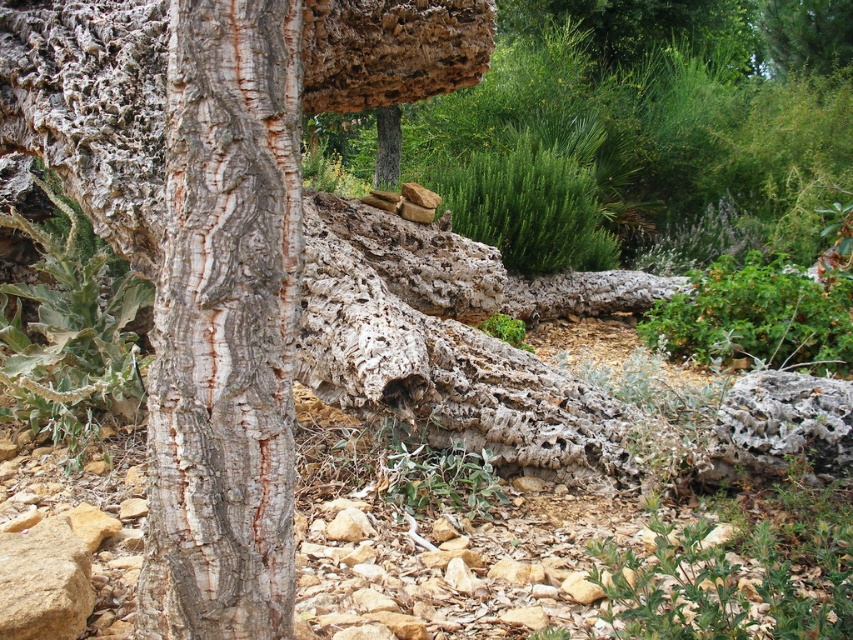
Does gray rough bark at center appear over green leafy plant at center?

Indeed, gray rough bark at center is positioned over green leafy plant at center.

Between gray rough bark at center and green leafy plant at center, which one has more height?

Standing taller between the two is gray rough bark at center.

Does point (260, 358) come closer to viewer compared to point (505, 339)?

Yes, point (260, 358) is in front of point (505, 339).

This screenshot has height=640, width=853. Identify the location of gray rough bark at center. (225, 326).